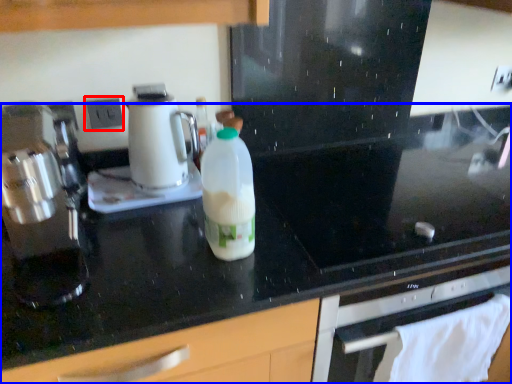
Question: Which point is closer to the camera, electric outlet (highlighted by a red box) or countertop (highlighted by a blue box)?

Choices:
 (A) electric outlet
 (B) countertop

Answer: (B)